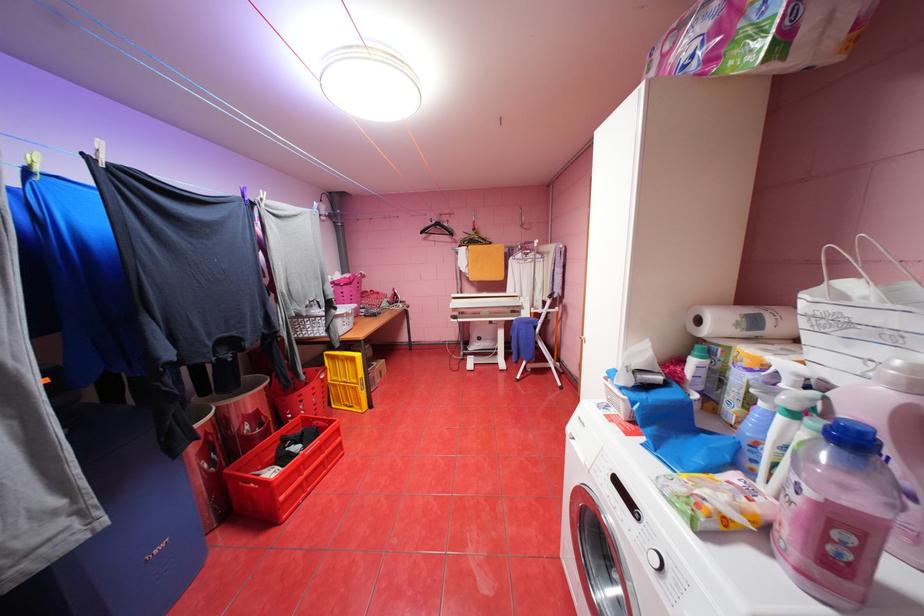
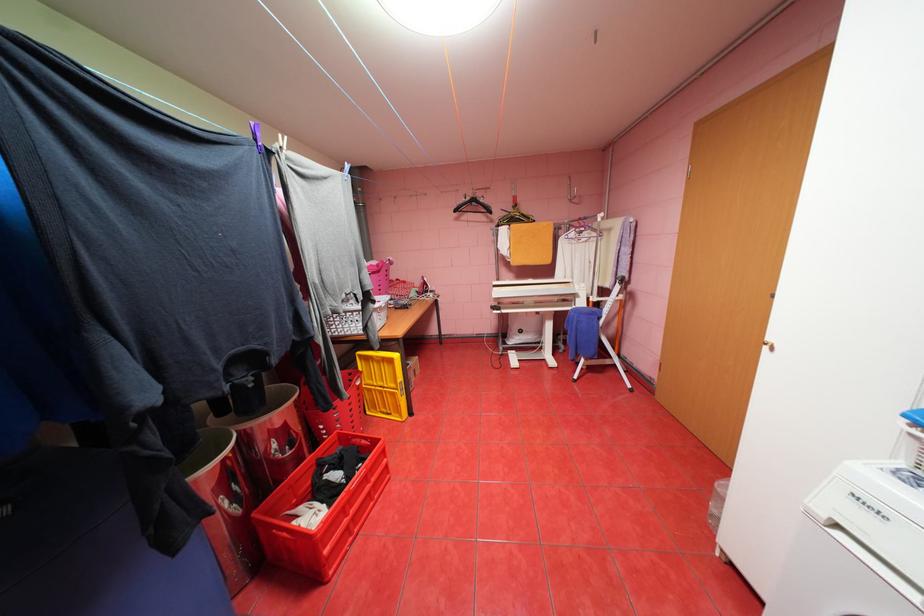
The point at (331, 456) is marked in the first image. Where is the corresponding point in the second image?

(377, 485)